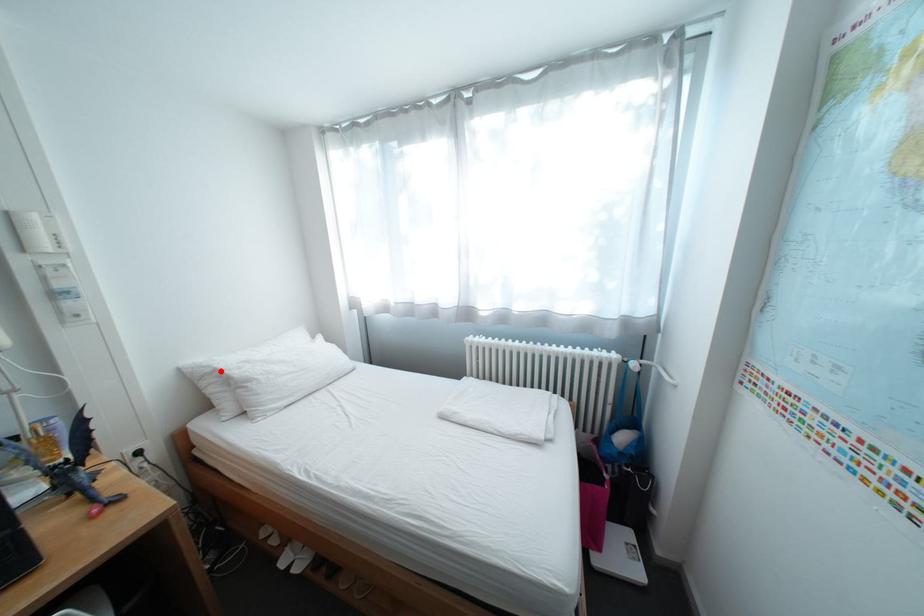
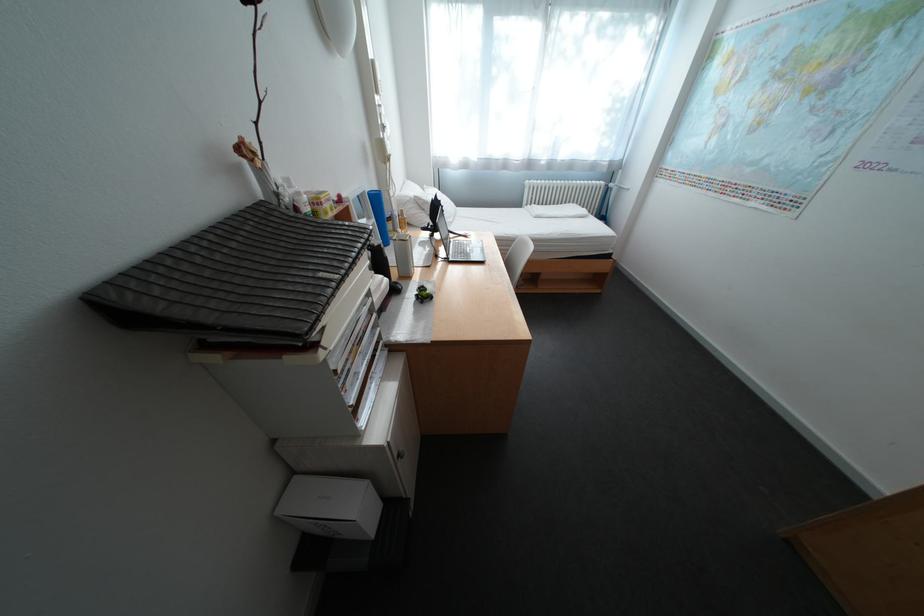
Where in the second image is the point corresponding to the highlighted location from the first image?

(420, 200)